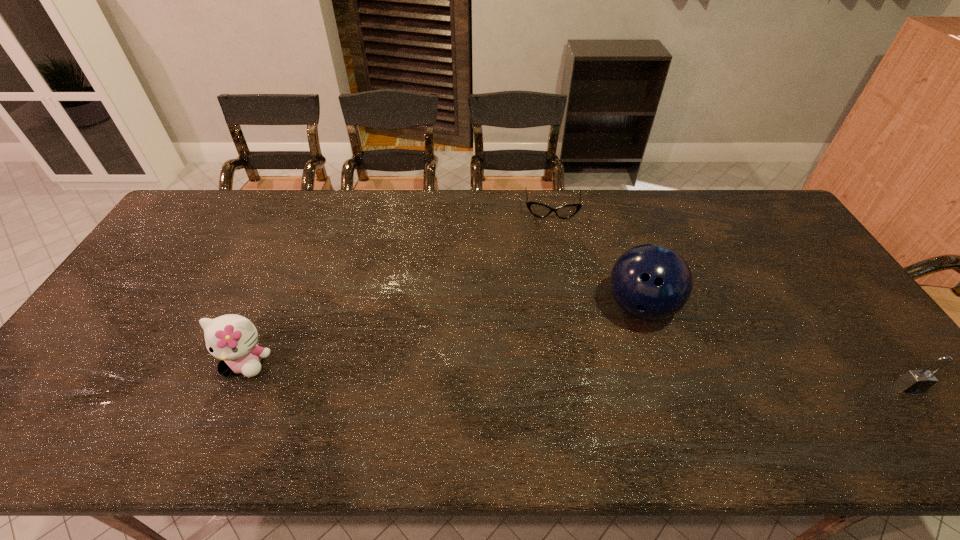
What are the coordinates of `vacant space that is in between the spectacles and the padlock` in the screenshot? It's located at (731, 299).

Where is `vacant area between the second farthest object and the rightmost object`? vacant area between the second farthest object and the rightmost object is located at coordinates (775, 347).

Locate an element on the screen. empty location between the farthest object and the second shortest object is located at coordinates (731, 299).

This screenshot has height=540, width=960. In order to click on object identified as the third closest to the third tallest object in this screenshot , I will do `click(232, 338)`.

Locate an element on the screen. the third closest object to the shortest object is located at coordinates (914, 381).